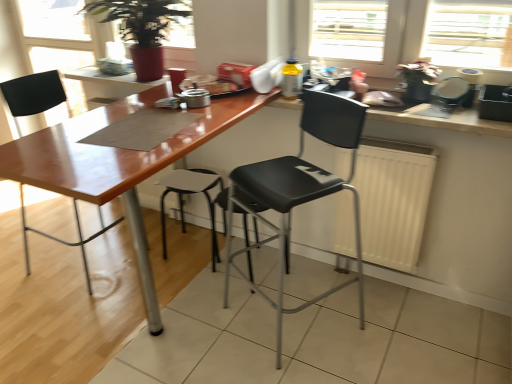
Where is `free space between matte wood table at center, the first table ordered from the bottom, and matte black stool at center`? free space between matte wood table at center, the first table ordered from the bottom, and matte black stool at center is located at coordinates (109, 296).